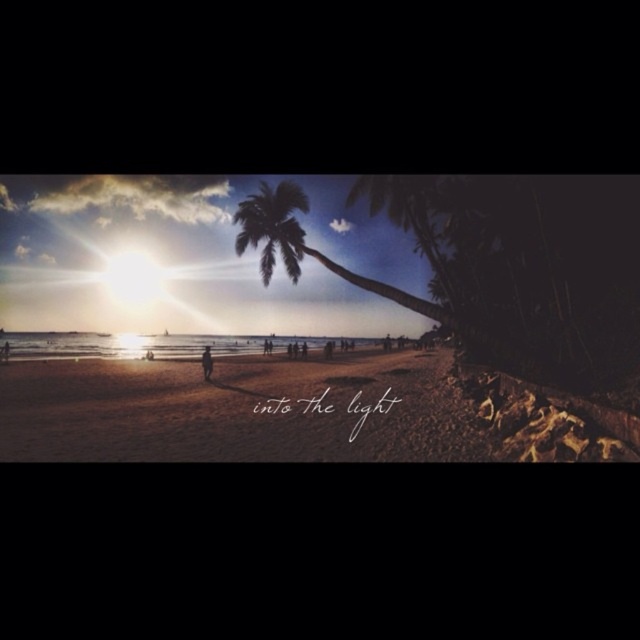
Question: Can you confirm if sandy beach at center is wider than silhouette figure at center?

Choices:
 (A) no
 (B) yes

Answer: (B)

Question: Does sandy beach at center appear over silhouette figure at center?

Choices:
 (A) no
 (B) yes

Answer: (A)

Question: Which point appears farthest from the camera in this image?

Choices:
 (A) (244, 243)
 (B) (209, 365)

Answer: (B)

Question: Which of the following is the closest to the observer?

Choices:
 (A) silhouette figure at center
 (B) sandy beach at center
 (C) green leafy palm tree at center

Answer: (B)

Question: Can you confirm if green leafy palm tree at center is positioned above silhouette figure at center?

Choices:
 (A) no
 (B) yes

Answer: (B)

Question: Estimate the real-world distances between objects in this image. Which object is farther from the sandy beach at center?

Choices:
 (A) silhouette figure at center
 (B) green leafy palm tree at center

Answer: (B)